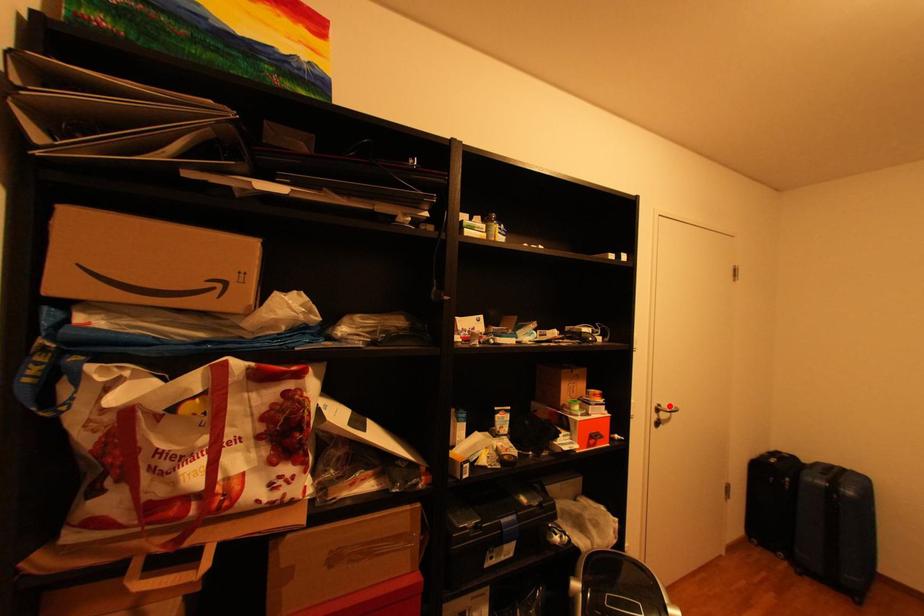
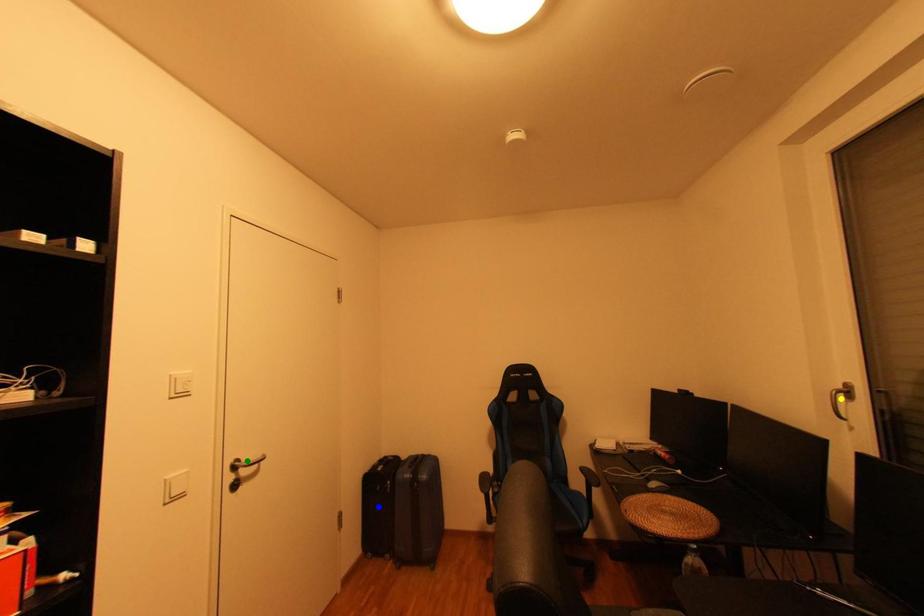
Question: I am providing you with two images of the same scene from different viewpoints. A red point is marked on the first image. You are given multiple points on the second image. In image 2, which mark is for the same physical point as the one in image 1?

Choices:
 (A) yellow point
 (B) blue point
 (C) green point

Answer: (C)